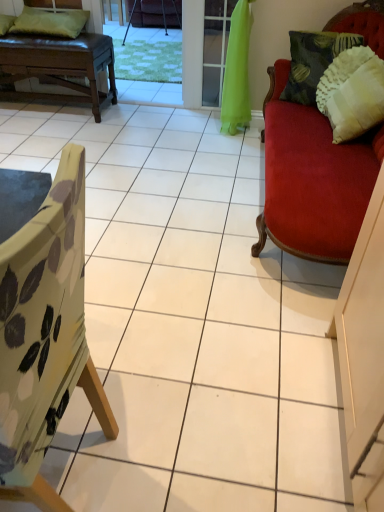
Question: Is floral fabric chair at left, the 2th chair from the back, shorter than green fabric pillow at upper left, which ranks as the 1th pillow in left-to-right order?

Choices:
 (A) no
 (B) yes

Answer: (A)

Question: Is floral fabric chair at left, placed as the 2th chair when sorted from top to bottom, bigger than green fabric pillow at upper left, which is counted as the 3th pillow, starting from the right?

Choices:
 (A) yes
 (B) no

Answer: (A)

Question: Can you confirm if floral fabric chair at left, the 2th chair from the back, is positioned to the right of green fabric pillow at upper left, which is counted as the 3th pillow, starting from the right?

Choices:
 (A) no
 (B) yes

Answer: (B)

Question: Is floral fabric chair at left, placed as the 2th chair when sorted from top to bottom, not within green fabric pillow at upper left, which is counted as the 3th pillow, starting from the right?

Choices:
 (A) yes
 (B) no

Answer: (A)

Question: Does floral fabric chair at left, which appears as the first chair when ordered from the bottom, lie in front of green fabric pillow at upper left, which ranks as the 1th pillow in left-to-right order?

Choices:
 (A) no
 (B) yes

Answer: (B)

Question: Is floral fabric chair at left, which appears as the first chair when ordered from the bottom, oriented away from green fabric pillow at upper left, which ranks as the 1th pillow in left-to-right order?

Choices:
 (A) yes
 (B) no

Answer: (B)

Question: Is white textured pillow at upper right, the first pillow in the right-to-left sequence, turned away from dark green textured pillow at upper right, the second pillow positioned from the right?

Choices:
 (A) no
 (B) yes

Answer: (B)

Question: Considering the relative sizes of white textured pillow at upper right, the first pillow in the right-to-left sequence, and dark green textured pillow at upper right, the second pillow positioned from the left, in the image provided, is white textured pillow at upper right, the first pillow in the right-to-left sequence, bigger than dark green textured pillow at upper right, the second pillow positioned from the left,?

Choices:
 (A) yes
 (B) no

Answer: (B)

Question: Would you say white textured pillow at upper right, the first pillow in the right-to-left sequence, is a long distance from dark green textured pillow at upper right, the second pillow positioned from the right?

Choices:
 (A) yes
 (B) no

Answer: (B)

Question: Could you tell me if white textured pillow at upper right, the third pillow positioned from the left, is turned towards dark green textured pillow at upper right, the second pillow positioned from the left?

Choices:
 (A) yes
 (B) no

Answer: (B)

Question: Considering the relative sizes of white textured pillow at upper right, the first pillow in the right-to-left sequence, and dark green textured pillow at upper right, the second pillow positioned from the left, in the image provided, is white textured pillow at upper right, the first pillow in the right-to-left sequence, taller than dark green textured pillow at upper right, the second pillow positioned from the left,?

Choices:
 (A) yes
 (B) no

Answer: (A)

Question: From a real-world perspective, is white textured pillow at upper right, the third pillow positioned from the left, under dark green textured pillow at upper right, the second pillow positioned from the right?

Choices:
 (A) no
 (B) yes

Answer: (B)

Question: Does green fabric screen door at center appear on the left side of brown leather bench at upper left?

Choices:
 (A) yes
 (B) no

Answer: (B)